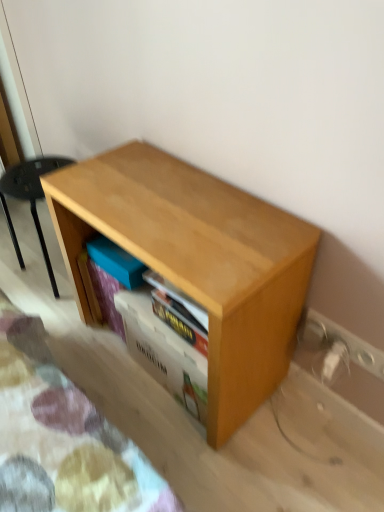
This screenshot has width=384, height=512. I want to click on blank space above light wood table at center (from a real-world perspective), so click(168, 204).